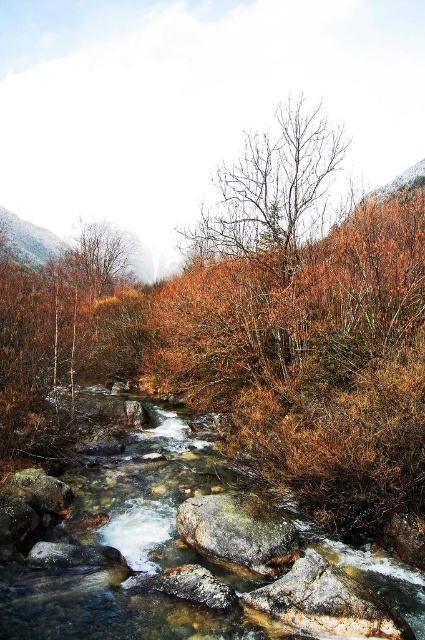
You are standing at the edge of the stream and want to cross it to reach a point further ahead. You notice two points marked on the stream bed. Which of the two points, point (243, 513) or point (115, 243), is closer to you and would be easier to step on first?

Point (243, 513) is closer to the viewer than point (115, 243), so it would be easier to step on first.

Consider the image. You are standing at the edge of the stream and see the rusty metallic rock at center and the smooth gray rock at center. Which rock is closer to you?

The rusty metallic rock at center is closer to you because the smooth gray rock at center is positioned behind it.